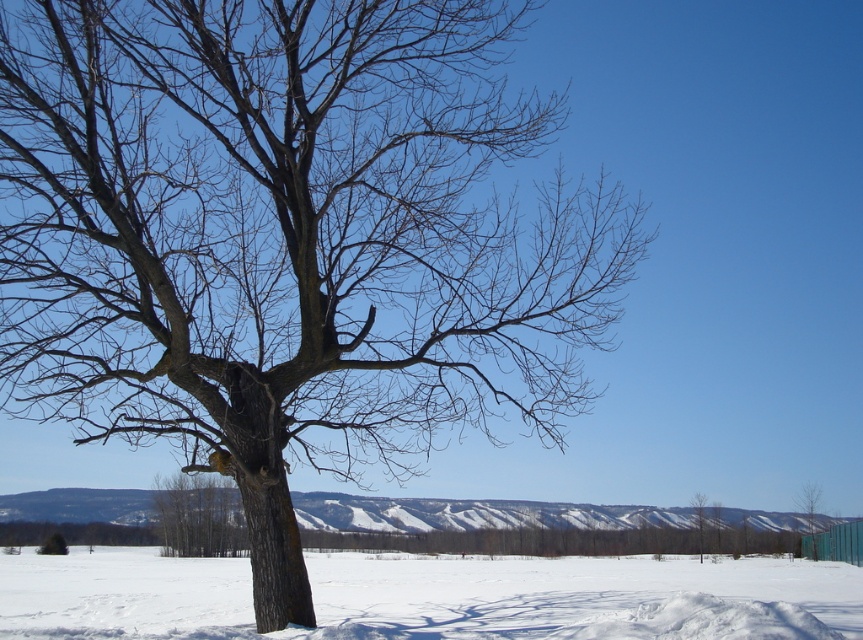
How distant is white powdery snow at center from green matte tree at lower right?

white powdery snow at center and green matte tree at lower right are 4.26 meters apart from each other.

Does white powdery snow at center appear over green matte tree at lower right?

No, white powdery snow at center is not above green matte tree at lower right.

Is point (565, 632) closer to camera compared to point (697, 506)?

Yes, point (565, 632) is closer to viewer.

This screenshot has height=640, width=863. Identify the location of white powdery snow at center. (432, 596).

Is white powdery snow at center taller than green matte tree at right?

No.

Is point (444, 602) positioned after point (813, 513)?

That is False.

Is point (210, 589) positioned after point (801, 506)?

No, it is not.

Image resolution: width=863 pixels, height=640 pixels. Identify the location of white powdery snow at center. (432, 596).

Which is more to the left, green matte tree at right or green matte tree at lower right?

green matte tree at lower right is more to the left.

Is point (807, 518) behind point (693, 493)?

Yes, it is behind point (693, 493).

Image resolution: width=863 pixels, height=640 pixels. I want to click on green matte tree at right, so click(809, 509).